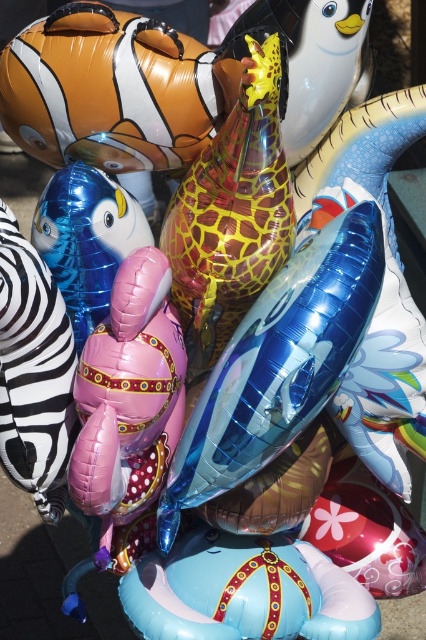
Can you confirm if metallic gold giraffe at center is bigger than metallic blue balloon at center-left?

Yes.

Who is more forward, (218, 272) or (86, 225)?

Point (218, 272)

Who is more distant from viewer, (238,150) or (75,196)?

Point (75,196)

What are the coordinates of `metallic gold giraffe at center` in the screenshot? It's located at (230, 212).